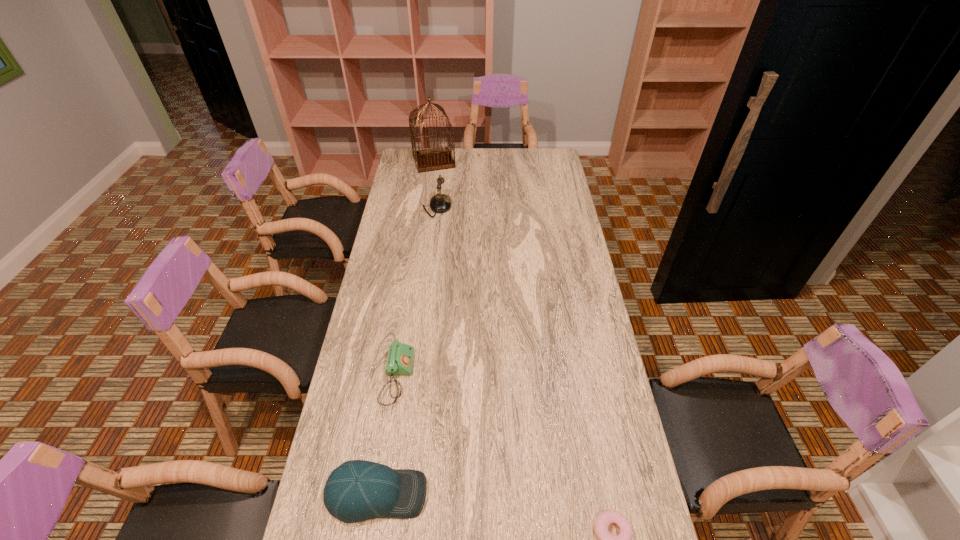
Where is `free space located 0.310m on the dial of the fourth tallest object`? free space located 0.310m on the dial of the fourth tallest object is located at coordinates (512, 377).

At what (x,y) coordinates should I click in order to perform the action: click on object located at the far edge. Please return your answer as a coordinate pair (x, y). Looking at the image, I should click on (433, 159).

Where is `birdcage present at the left edge`? birdcage present at the left edge is located at coordinates (433, 159).

Where is `baseball cap positioned at the left edge`? baseball cap positioned at the left edge is located at coordinates (358, 490).

Locate an element on the screen. The height and width of the screenshot is (540, 960). object that is at the far left corner is located at coordinates (433, 159).

I want to click on free spot at the far edge of the desktop, so click(460, 152).

Find the location of `vacant space at the left edge`. vacant space at the left edge is located at coordinates (372, 354).

In the image, there is a desktop. Identify the location of free space at the right edge. Image resolution: width=960 pixels, height=540 pixels. (637, 502).

Locate an element on the screen. free location at the far right corner is located at coordinates (558, 152).

Identify the location of vacant area that lies between the third tallest object and the farthest object. (405, 327).